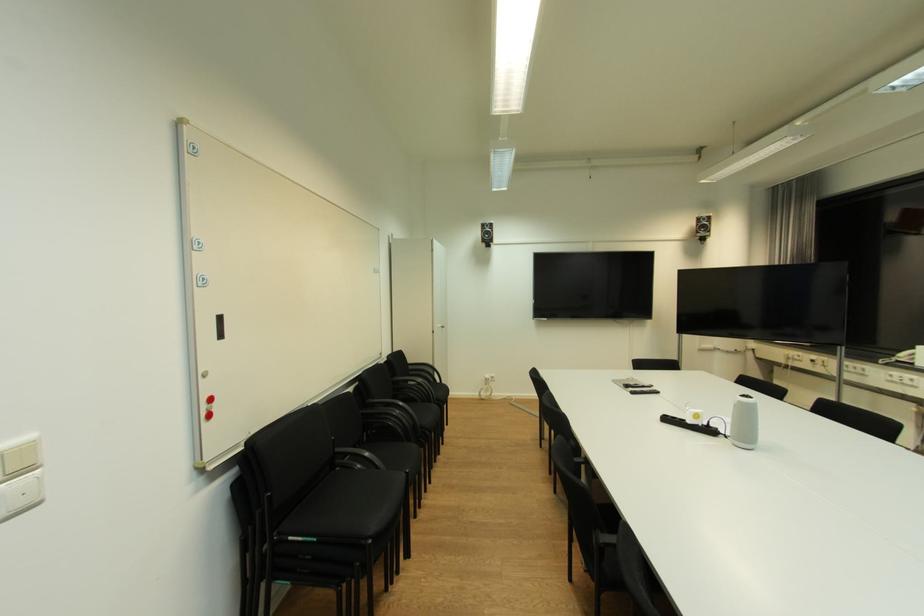
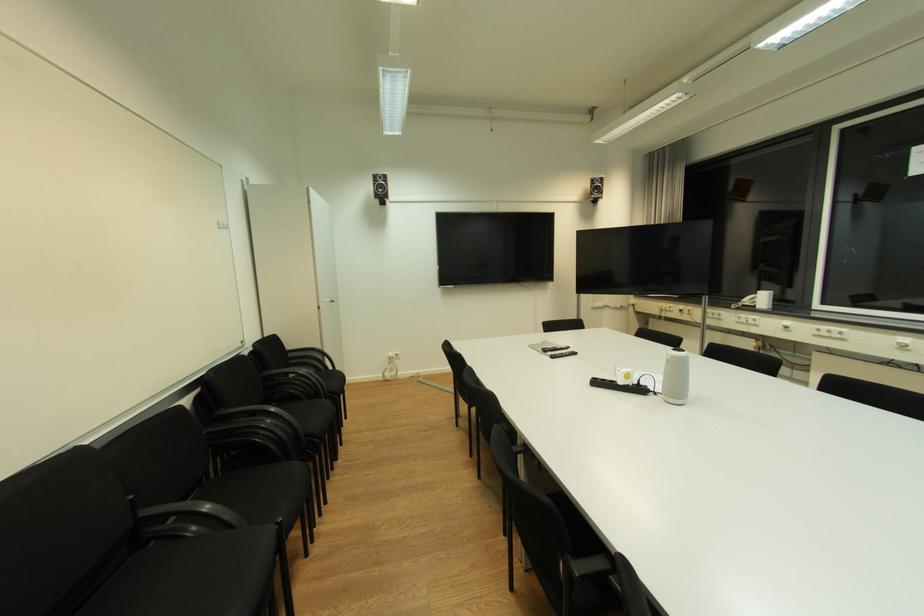
The point at [628,387] is marked in the first image. Where is the corresponding point in the second image?

(546, 352)